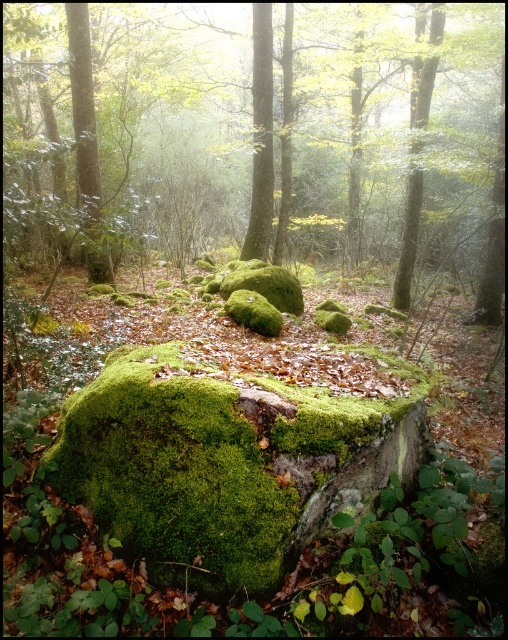
Question: Which object is the farthest from the smooth bark tree at upper right?

Choices:
 (A) green mossy rock at center
 (B) green mossy rock at left

Answer: (B)

Question: Which point is farther to the camera?

Choices:
 (A) green mossy rock at left
 (B) green mossy rock at center

Answer: (A)

Question: Does green mossy rock at left have a greater width compared to smooth bark tree at upper right?

Choices:
 (A) yes
 (B) no

Answer: (B)

Question: Does green mossy rock at left appear on the left side of green mossy tree trunk at center?

Choices:
 (A) no
 (B) yes

Answer: (B)

Question: Does green mossy rock at left appear under smooth bark tree at upper right?

Choices:
 (A) yes
 (B) no

Answer: (A)

Question: Which point appears closest to the camera in this image?

Choices:
 (A) (254, 100)
 (B) (228, 56)
 (C) (417, 202)
 (D) (98, 240)

Answer: (D)